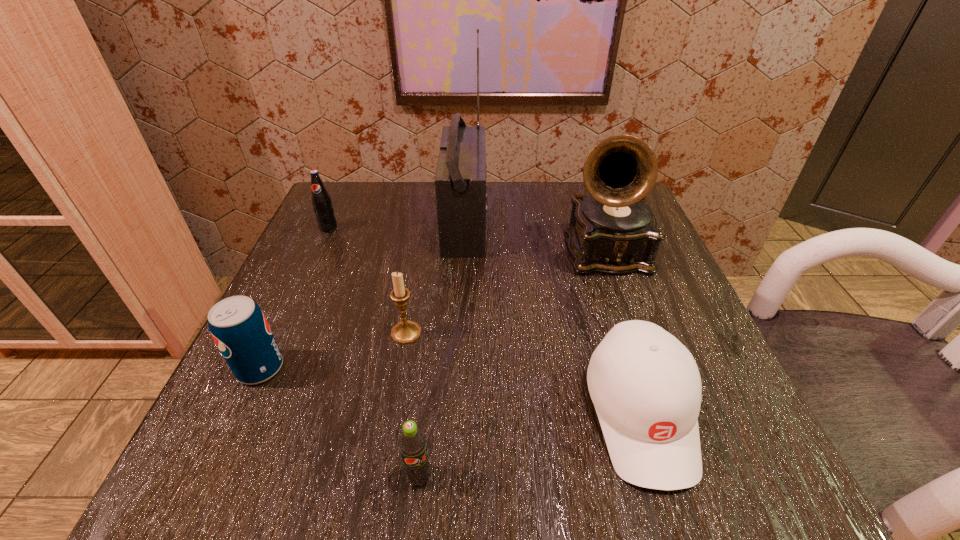
Image resolution: width=960 pixels, height=540 pixels. Find the location of `free space between the rightmost soda and the radio receiver`. free space between the rightmost soda and the radio receiver is located at coordinates (443, 350).

Identify the location of free point between the radio receiver and the farthest soda. (396, 226).

Locate an element on the screen. free area in between the radio receiver and the farthest soda is located at coordinates (396, 226).

Find the location of a particular element. Image resolution: width=960 pixels, height=540 pixels. vacant space in between the radio receiver and the farthest soda is located at coordinates (396, 226).

Where is `empty space that is in between the farthest soda and the second farthest soda`? The image size is (960, 540). empty space that is in between the farthest soda and the second farthest soda is located at coordinates (295, 298).

Image resolution: width=960 pixels, height=540 pixels. In order to click on blank region between the second farthest soda and the baseball cap in this screenshot , I will do `click(450, 391)`.

Find the location of `object identified as the fourth closest to the phonograph record`. object identified as the fourth closest to the phonograph record is located at coordinates (412, 443).

The image size is (960, 540). Find the location of `object that ranks as the second closest to the farthest soda`. object that ranks as the second closest to the farthest soda is located at coordinates tap(405, 332).

Identify which soda is the second closest to the candle holder. Please provide its 2D coordinates. Your answer should be formatted as a tuple, i.e. [(x, y)], where the tuple contains the x and y coordinates of a point satisfying the conditions above.

[(412, 443)]

Where is `soda that stands as the third closest to the phonograph record`? soda that stands as the third closest to the phonograph record is located at coordinates (237, 324).